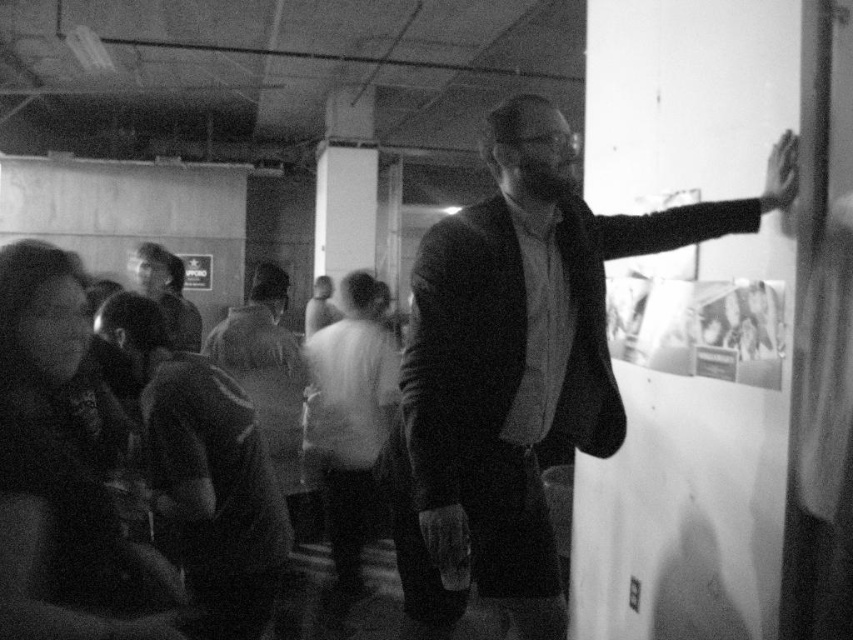
You are an interior designer assessing the space in the image. You notice the matte black suit at center and the smooth skin hand at upper right. Which object occupies more vertical space in the scene?

The matte black suit at center has a greater height compared to the smooth skin hand at upper right, so it occupies more vertical space in the scene.

In the scene shown: You are a photographer setting up for a portrait shoot in the room. You need to position a light source between the dark fabric jacket at lower left and the smooth skin hand at upper right. The light source requires a minimum of 1.5 meters of space to function properly. Based on the scene, will the available space between these two objects accommodate the light source?

The distance between the dark fabric jacket at lower left and the smooth skin hand at upper right is 1.61 meters, which exceeds the required 1.5 meters. Therefore, the light source can be placed between them with sufficient space.